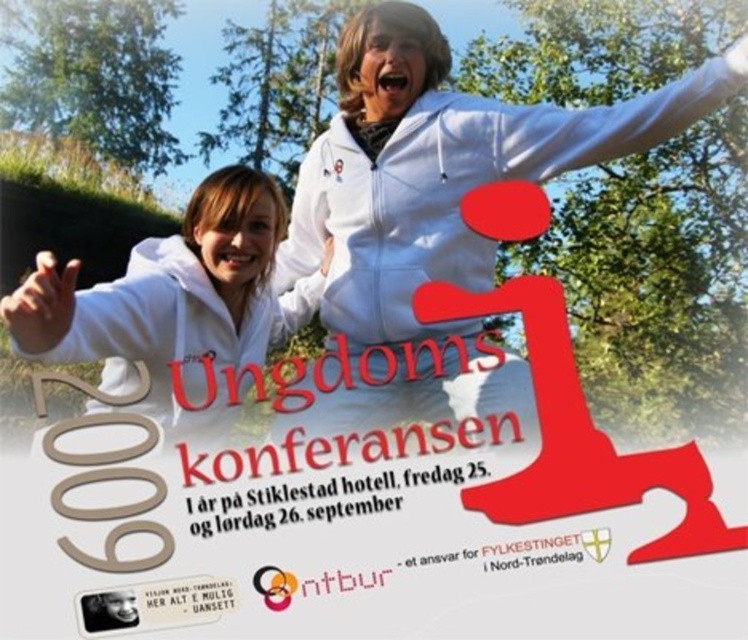
Question: Which object is farther from the camera taking this photo?

Choices:
 (A) white matte arm at upper left
 (B) white smooth arm at upper right
 (C) white zip-up hoodie at upper center

Answer: (B)

Question: Which object is the farthest from the white smooth arm at upper right?

Choices:
 (A) white matte arm at upper left
 (B) white zip-up hoodie at upper center

Answer: (A)

Question: Can you confirm if white matte hoodie at center is positioned to the right of white smooth arm at upper right?

Choices:
 (A) yes
 (B) no

Answer: (B)

Question: Does white matte hoodie at center appear on the left side of white smooth arm at upper right?

Choices:
 (A) no
 (B) yes

Answer: (B)

Question: Estimate the real-world distances between objects in this image. Which object is closer to the white zip-up hoodie at upper center?

Choices:
 (A) white smooth arm at upper right
 (B) white matte arm at upper left

Answer: (A)

Question: Is white zip-up hoodie at upper center closer to the viewer compared to white matte arm at upper left?

Choices:
 (A) yes
 (B) no

Answer: (B)